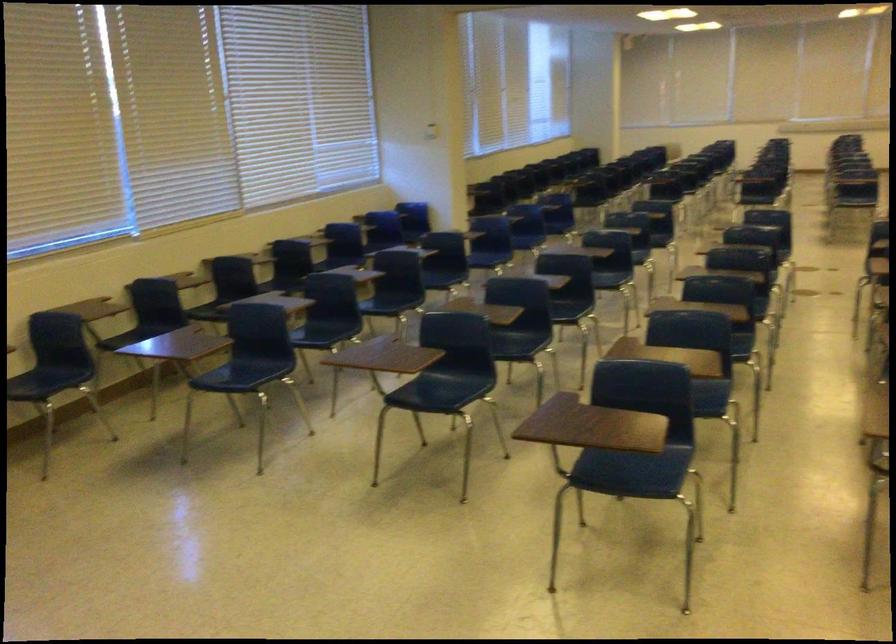
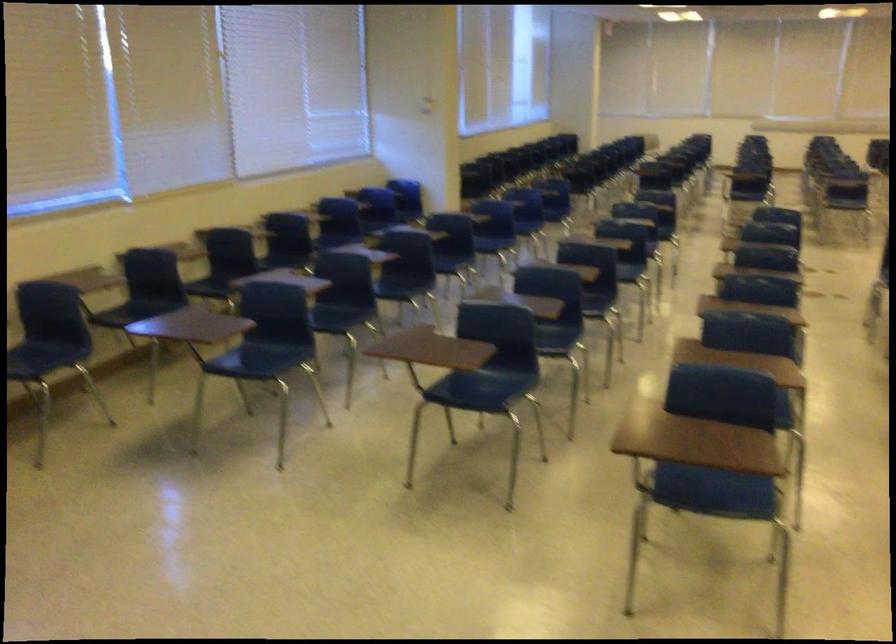
Question: The first image is from the beginning of the video and the second image is from the end. How did the camera likely rotate when shooting the video?

Choices:
 (A) Left
 (B) Right
 (C) Up
 (D) Down

Answer: (B)